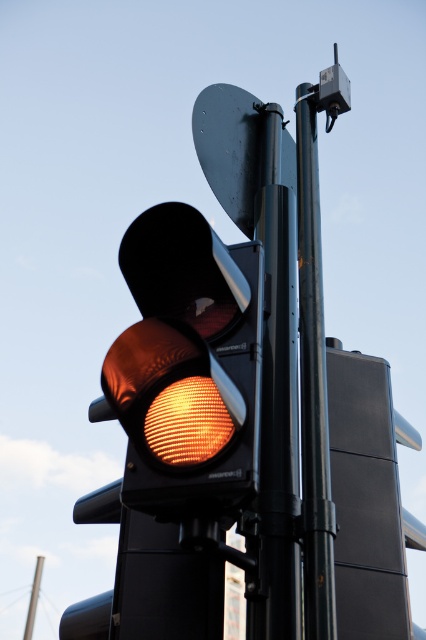
Question: Does matte orange glass traffic light at center have a larger size compared to black matte pole at center?

Choices:
 (A) yes
 (B) no

Answer: (B)

Question: Is matte orange glass traffic light at center thinner than smooth black sign at upper center?

Choices:
 (A) yes
 (B) no

Answer: (A)

Question: Which is farther from the orange led at center?

Choices:
 (A) smooth black sign at upper center
 (B) black matte pole at center
 (C) black metallic pole at center

Answer: (A)

Question: Does black metallic pole at center appear on the left side of orange led at center?

Choices:
 (A) yes
 (B) no

Answer: (B)

Question: Which point appears closest to the camera in this image?

Choices:
 (A) (316, 314)
 (B) (172, 410)
 (C) (193, 346)

Answer: (C)

Question: Which object is farther from the camera taking this photo?

Choices:
 (A) black matte pole at center
 (B) smooth black sign at upper center

Answer: (B)